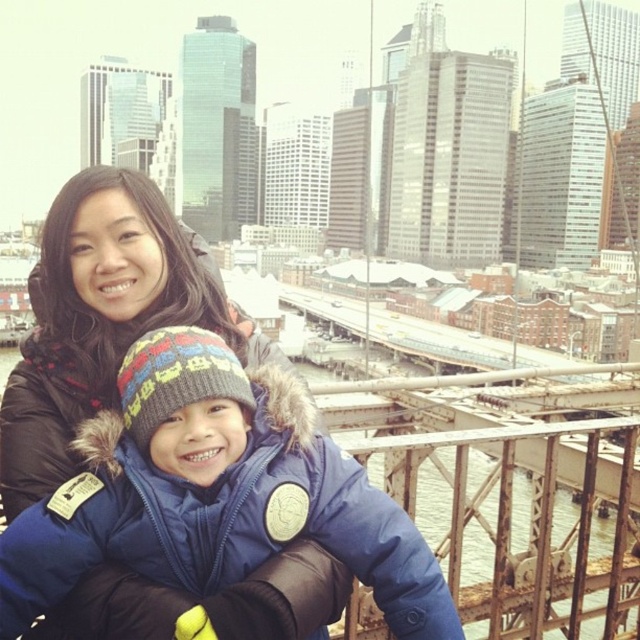
You are a photographer standing at the Brooklyn Bridge. You see the blue down jacket at center and the matte black coat at center in your viewfinder. You need to ensure both subjects are in focus. The camera you are using has a depth of field that can cover 20 feet. Will both subjects be in focus?

The distance between the blue down jacket at center and the matte black coat at center is 20.81 feet. Since the camera can only cover 20 feet, the subjects will not both be in focus.

You are a photographer trying to capture the two people in the image. You want to ensure the blue down jacket at center and the matte black coat at center are both in focus. Since the camera can only focus on one subject at a time, which one should you focus on first to ensure both are sharp?

The blue down jacket at center is to the right of the matte black coat at center. Since the camera focuses on the closest subject first, you should focus on the matte black coat at center first, then the blue down jacket at center will also be in focus as they are aligned horizontally.